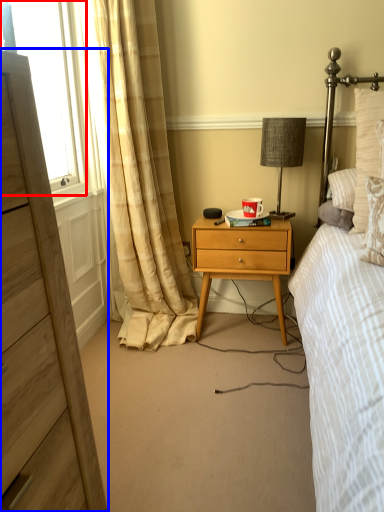
Question: Which object appears closest to the camera in this image, window screen (highlighted by a red box) or chest of drawers (highlighted by a blue box)?

Choices:
 (A) window screen
 (B) chest of drawers

Answer: (B)